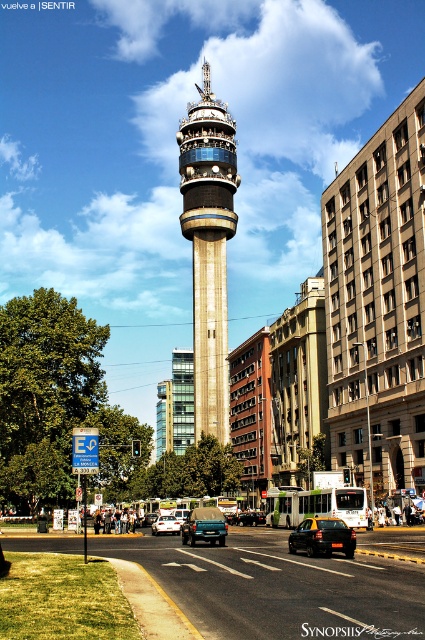
Question: Which of the following is the farthest from the observer?

Choices:
 (A) matte black car at center
 (B) metallic silver sedan at center

Answer: (A)

Question: Can you confirm if matte blue car at center is positioned above metallic silver sedan at center?

Choices:
 (A) yes
 (B) no

Answer: (A)

Question: Which point appears farthest from the camera in this image?

Choices:
 (A) (254, 513)
 (B) (192, 234)

Answer: (B)

Question: Does matte blue car at center have a larger size compared to metallic silver sedan at center?

Choices:
 (A) yes
 (B) no

Answer: (A)

Question: Observing the image, what is the correct spatial positioning of matte blue car at center in reference to metallic silver sedan at center?

Choices:
 (A) right
 (B) left

Answer: (A)

Question: Based on their relative distances, which object is farther from the matte glass control tower at center?

Choices:
 (A) matte black car at center
 (B) black matte car at center
 (C) matte blue car at center

Answer: (B)